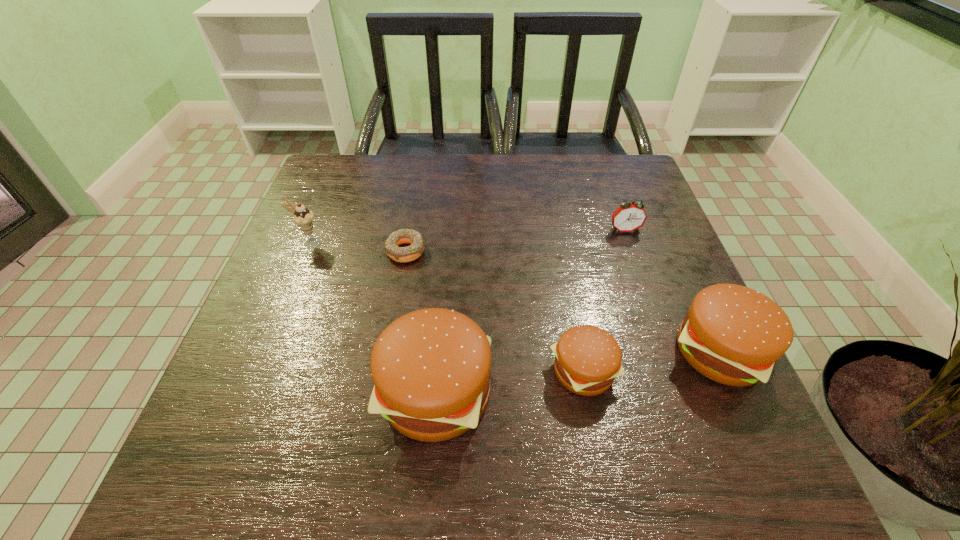
Find the location of a particular element. The image size is (960, 540). the leftmost hamburger is located at coordinates (431, 368).

Image resolution: width=960 pixels, height=540 pixels. In order to click on the third object from right to left in this screenshot , I will do `click(587, 359)`.

Find the location of a particular element. Image resolution: width=960 pixels, height=540 pixels. the second hamburger from left to right is located at coordinates [587, 359].

Find the location of a particular element. The height and width of the screenshot is (540, 960). the rightmost hamburger is located at coordinates (734, 335).

Where is `the shortest object`? Image resolution: width=960 pixels, height=540 pixels. the shortest object is located at coordinates (400, 254).

Identify the location of the third shortest object. (629, 217).

At what (x,y) coordinates should I click in order to perform the action: click on the farthest object. Please return your answer as a coordinate pair (x, y). Looking at the image, I should click on (629, 217).

You are a GUI agent. You are given a task and a screenshot of the screen. Output one action in this format:
    pyautogui.click(x=<x>, y=<y>)
    Task: Click on the icecream
    
    Given the screenshot: What is the action you would take?
    pyautogui.click(x=304, y=218)

Where is `vacant space located on the back of the leftmost hamburger`? This screenshot has height=540, width=960. vacant space located on the back of the leftmost hamburger is located at coordinates (446, 261).

Locate an element on the screen. vacant space located 0.240m on the left of the fifth tallest object is located at coordinates (420, 372).